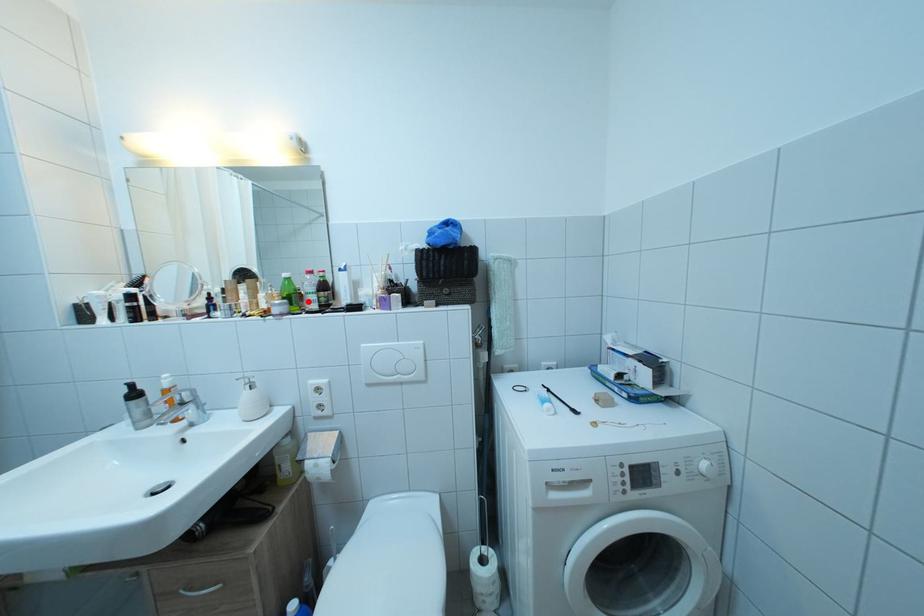
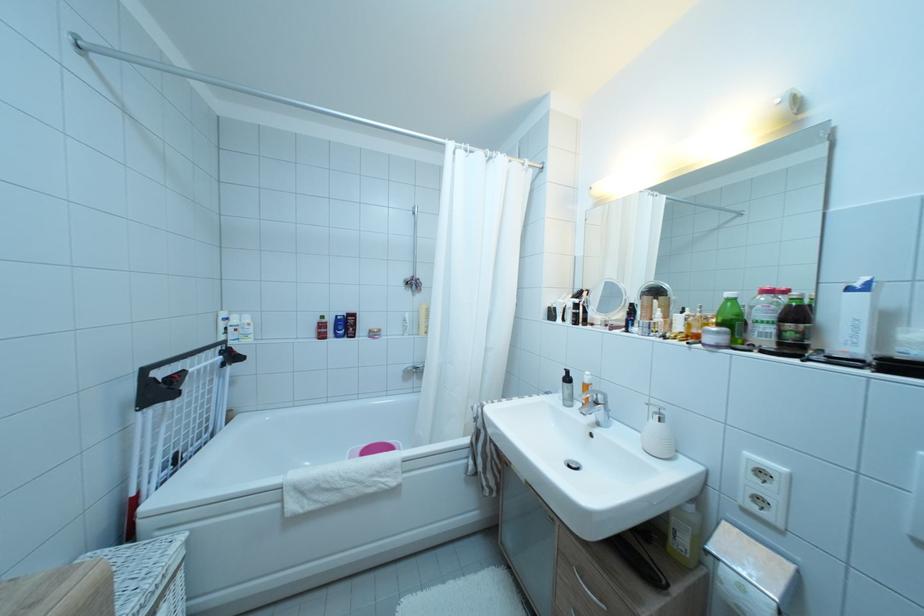
Locate, in the second image, the point that corresponds to the highlighted location in the first image.

(754, 330)